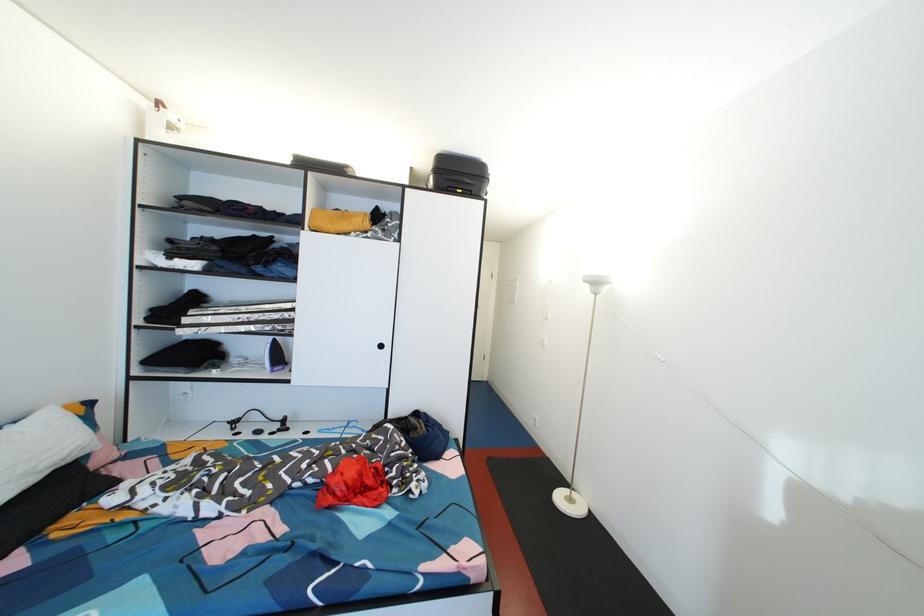
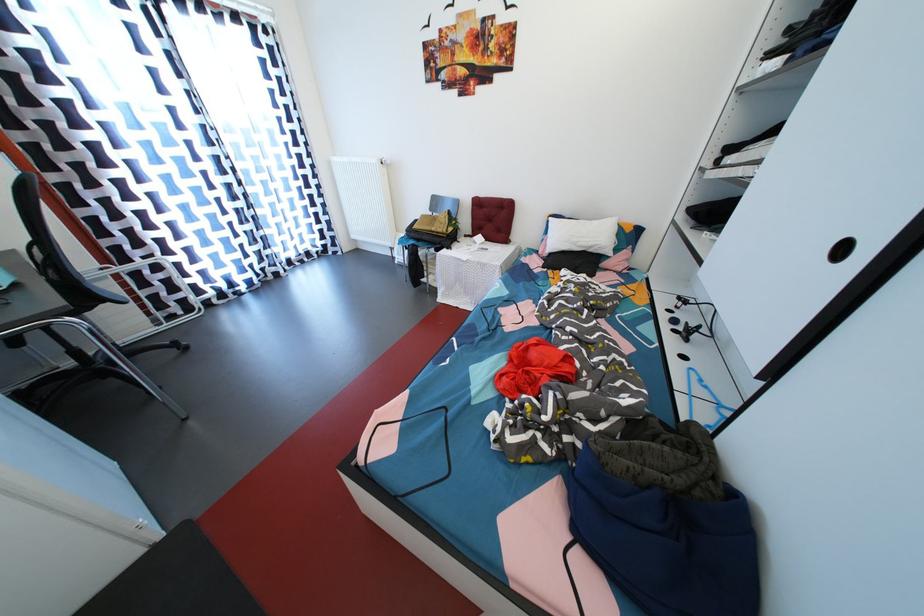
Where in the second image is the point corresponding to pixel 277 439 from the first image?

(681, 336)